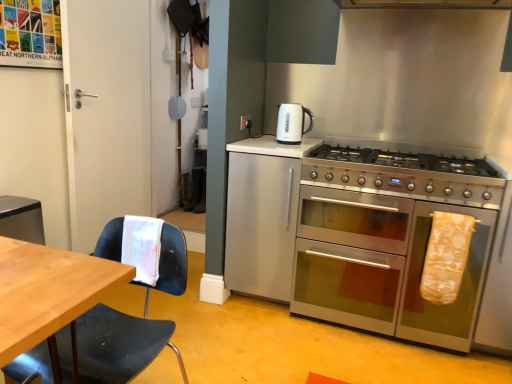
Question: Can you confirm if black plastic chair at left is positioned to the right of white matte door at left?

Choices:
 (A) yes
 (B) no

Answer: (A)

Question: Is black plastic chair at left not close to white matte door at left?

Choices:
 (A) no
 (B) yes

Answer: (B)

Question: Is black plastic chair at left at the left side of white matte door at left?

Choices:
 (A) no
 (B) yes

Answer: (A)

Question: Is black plastic chair at left wider than white matte door at left?

Choices:
 (A) yes
 (B) no

Answer: (A)

Question: Is the position of black plastic chair at left more distant than that of white matte door at left?

Choices:
 (A) no
 (B) yes

Answer: (A)

Question: Is black plastic chair at left with white matte door at left?

Choices:
 (A) no
 (B) yes

Answer: (A)

Question: Is white glossy electric kettle at upper center at the left side of stainless steel oven at right?

Choices:
 (A) yes
 (B) no

Answer: (A)

Question: Considering the relative positions of white glossy electric kettle at upper center and stainless steel oven at right in the image provided, is white glossy electric kettle at upper center to the right of stainless steel oven at right from the viewer's perspective?

Choices:
 (A) no
 (B) yes

Answer: (A)

Question: Considering the relative sizes of white glossy electric kettle at upper center and stainless steel oven at right in the image provided, is white glossy electric kettle at upper center shorter than stainless steel oven at right?

Choices:
 (A) no
 (B) yes

Answer: (B)

Question: From the image's perspective, would you say white glossy electric kettle at upper center is shown under stainless steel oven at right?

Choices:
 (A) yes
 (B) no

Answer: (B)

Question: From a real-world perspective, is white glossy electric kettle at upper center on stainless steel oven at right?

Choices:
 (A) no
 (B) yes

Answer: (B)

Question: Would you say stainless steel oven at right is part of white glossy electric kettle at upper center's contents?

Choices:
 (A) yes
 (B) no

Answer: (B)

Question: Does yellow fabric oven mitt at right, which is the second material from left to right, have a greater width compared to white matte door at left?

Choices:
 (A) yes
 (B) no

Answer: (B)